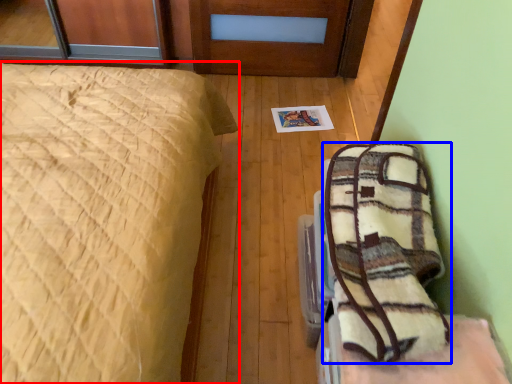
Question: Among these objects, which one is farthest to the camera, bed (highlighted by a red box) or blanket (highlighted by a blue box)?

Choices:
 (A) bed
 (B) blanket

Answer: (B)